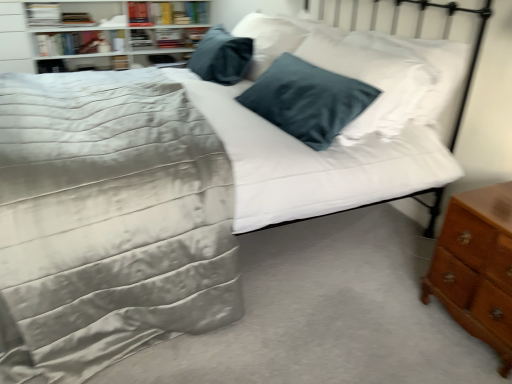
Image resolution: width=512 pixels, height=384 pixels. What are the coordinates of `free space above hardcover book at upper left, the second book when ordered from left to right (from a real-world perspective)` in the screenshot? It's located at (55, 24).